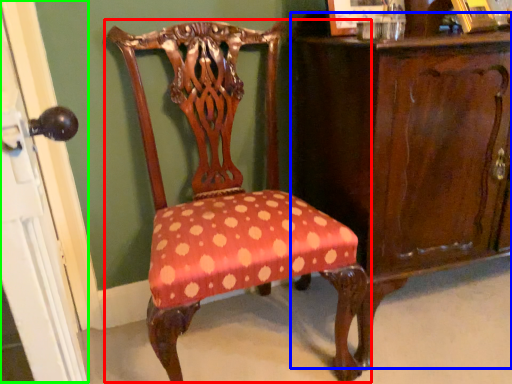
Question: Considering the real-world distances, which object is farthest from chair (highlighted by a red box)? vanity (highlighted by a blue box) or screen door (highlighted by a green box)?

Choices:
 (A) vanity
 (B) screen door

Answer: (B)